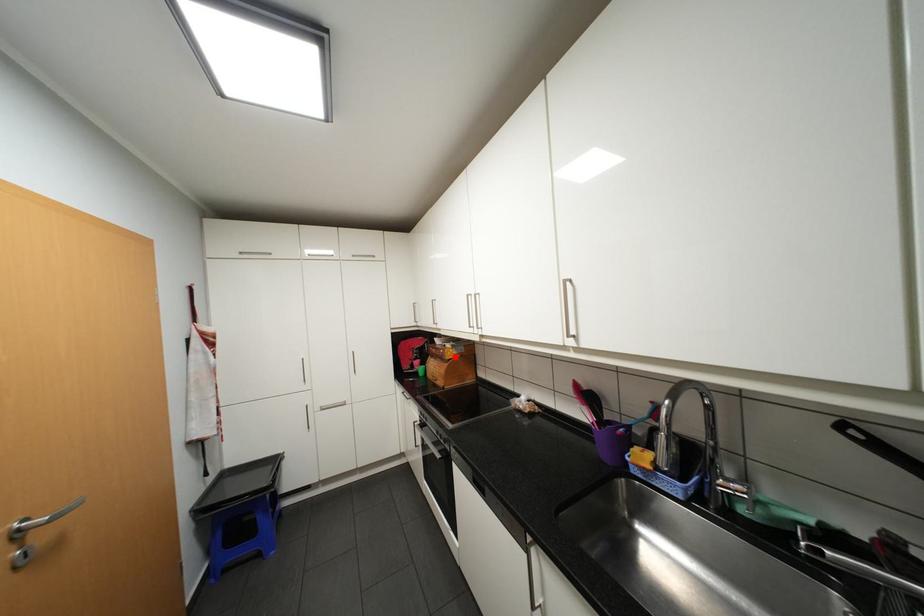
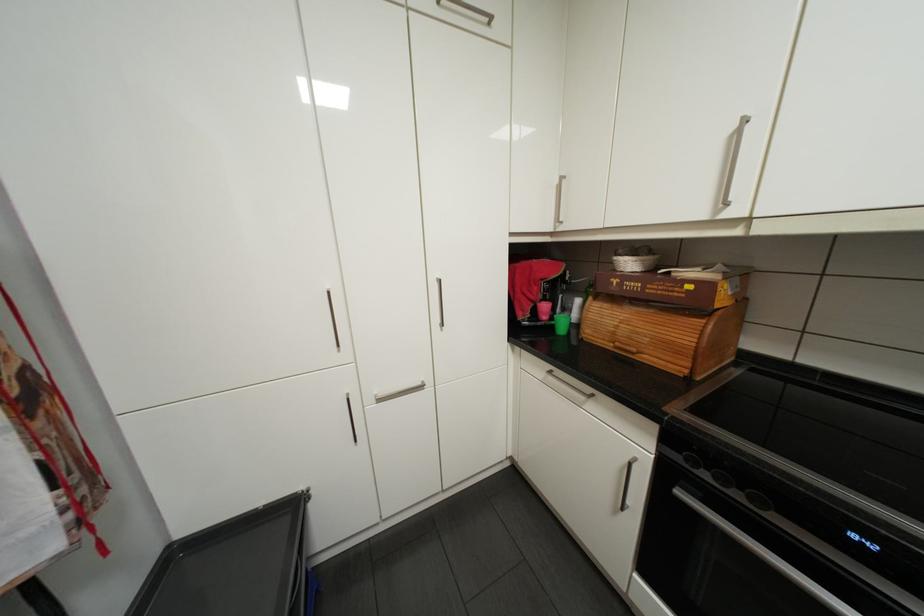
Question: I am providing you with two images of the same scene from different viewpoints. A red point is shown in image1. For the corresponding object point in image2, is it positioned nearer or farther from the camera?

Choices:
 (A) Nearer
 (B) Farther

Answer: (A)